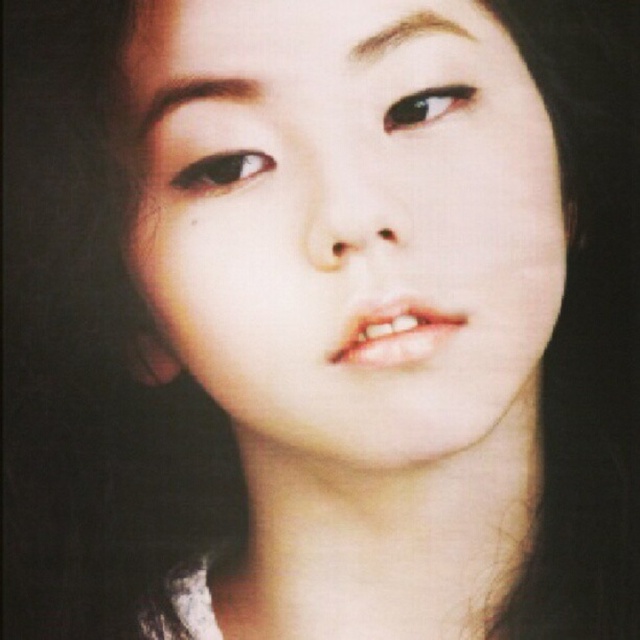
Which is below, brown matte eye at center or brown glossy eye at upper center?

brown matte eye at center is below.

Is brown matte eye at center positioned at the back of brown glossy eye at upper center?

That is True.

Does point (214, 157) come closer to viewer compared to point (435, 113)?

That is True.

Find the location of a particular element. The height and width of the screenshot is (640, 640). brown matte eye at center is located at coordinates (221, 172).

Who is more distant from viewer, (237, 333) or (214, 176)?

Positioned behind is point (237, 333).

Can you confirm if smooth skin face at center is thinner than brown matte eye at center?

In fact, smooth skin face at center might be wider than brown matte eye at center.

You are a GUI agent. You are given a task and a screenshot of the screen. Output one action in this format:
    pyautogui.click(x=<x>, y=<y>)
    Task: Click on the smooth skin face at center
    Image resolution: width=640 pixels, height=640 pixels.
    Given the screenshot: What is the action you would take?
    pyautogui.click(x=346, y=220)

The height and width of the screenshot is (640, 640). Identify the location of smooth skin face at center. (346, 220).

Can you confirm if smooth skin face at center is wider than brown glossy eye at upper center?

Yes, smooth skin face at center is wider than brown glossy eye at upper center.

Between smooth skin face at center and brown glossy eye at upper center, which one has more height?

smooth skin face at center is taller.

Where is `smooth skin face at center`? The image size is (640, 640). smooth skin face at center is located at coordinates (346, 220).

In order to click on smooth skin face at center in this screenshot , I will do `click(346, 220)`.